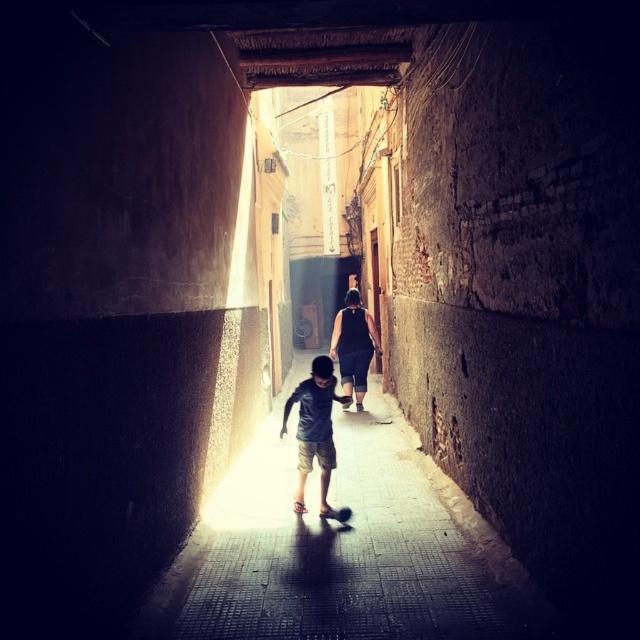
You are standing at the entrance of the alley and want to take a photo. There are two points in the scene labeled as point (458, 621) and point (362, 369). Which point should you focus on to ensure it appears clearer in the photo?

Point (458, 621) should be focused on because it is closer to the camera and thus clearer than point (362, 369).

You are standing at the entrance of the alley and want to walk straight ahead towards the sunlight. Is the smooth concrete sidewalk at center directly in your path?

The smooth concrete sidewalk at center is located at point (340, 550), which is directly in the path towards the sunlight. Yes, you can walk straight ahead towards the sunlight along the smooth concrete sidewalk at center.